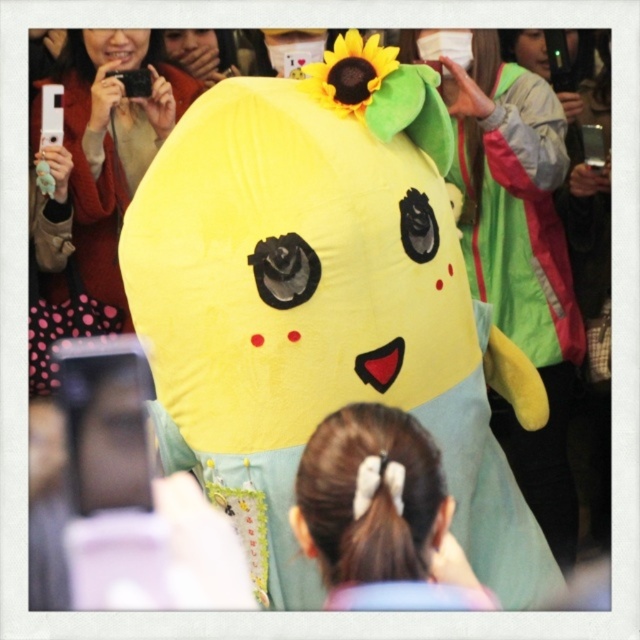
Question: Which object is closer to the camera taking this photo?

Choices:
 (A) matte yellow costume at upper left
 (B) matte yellow plushie at center

Answer: (A)

Question: Is smooth skin face at upper left thinner than matte yellow plushie at center?

Choices:
 (A) no
 (B) yes

Answer: (A)

Question: Among these objects, which one is farthest from the camera?

Choices:
 (A) matte yellow costume at upper left
 (B) smooth skin face at upper left
 (C) matte yellow costume at center
 (D) white fabric ponytail at center

Answer: (C)

Question: Which object is farther from the camera taking this photo?

Choices:
 (A) white fabric ponytail at center
 (B) smooth skin face at upper left

Answer: (B)

Question: Is matte yellow costume at upper left above matte yellow plushie at center?

Choices:
 (A) no
 (B) yes

Answer: (A)

Question: Does matte yellow costume at upper left appear on the left side of matte yellow costume at center?

Choices:
 (A) no
 (B) yes

Answer: (B)